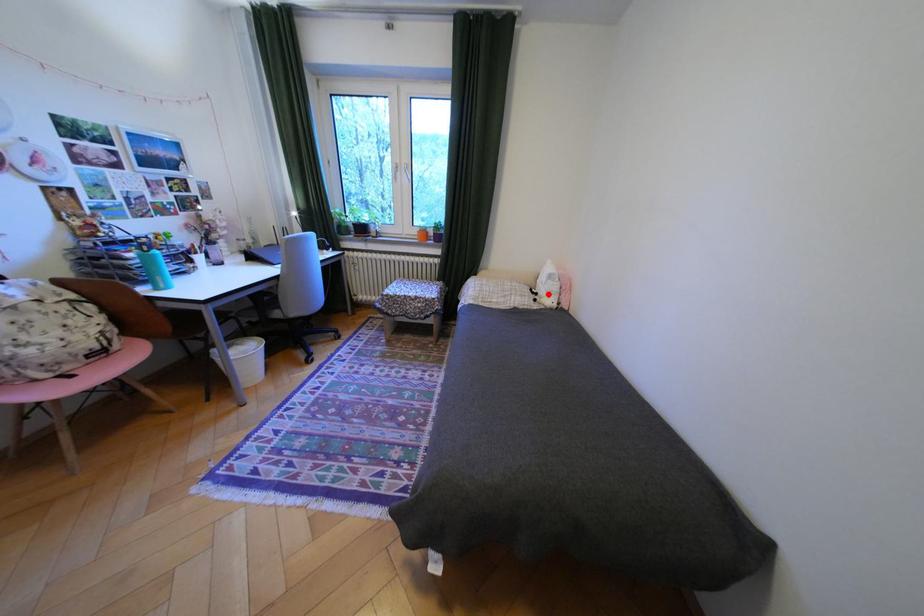
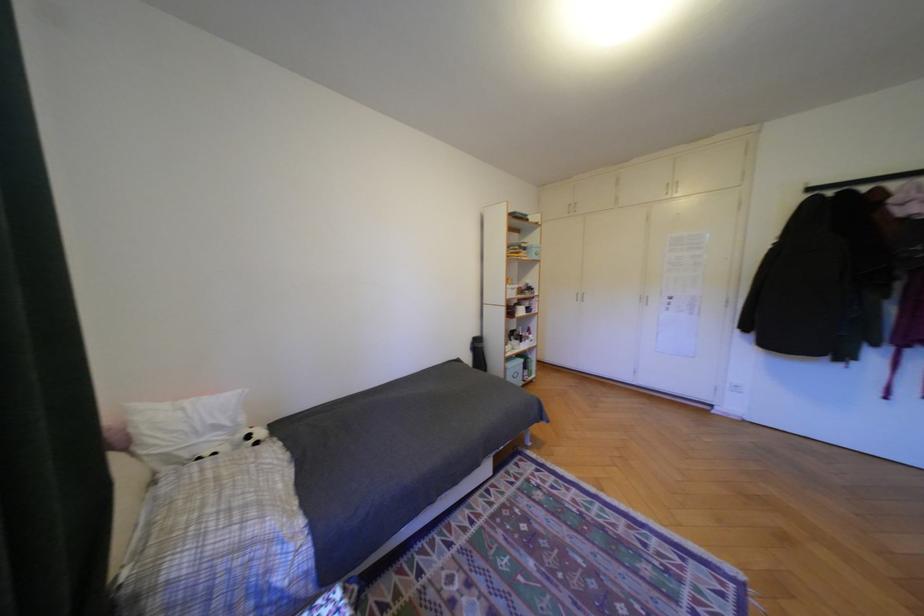
Question: I am providing you with two images of the same scene from different viewpoints. A red point is marked on the first image. At the location where the point appears in image 1, is it still visible in image 2?

Choices:
 (A) Yes
 (B) No

Answer: (A)